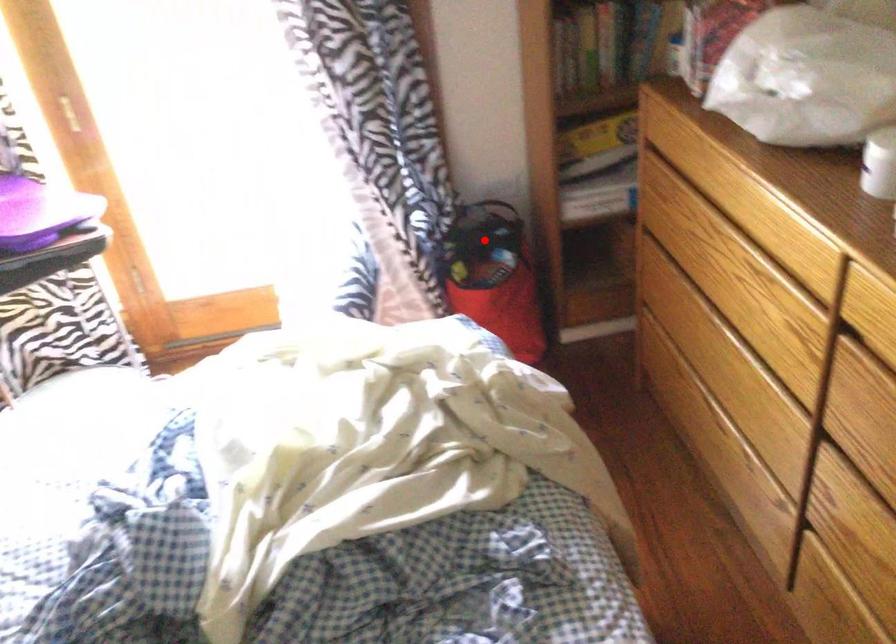
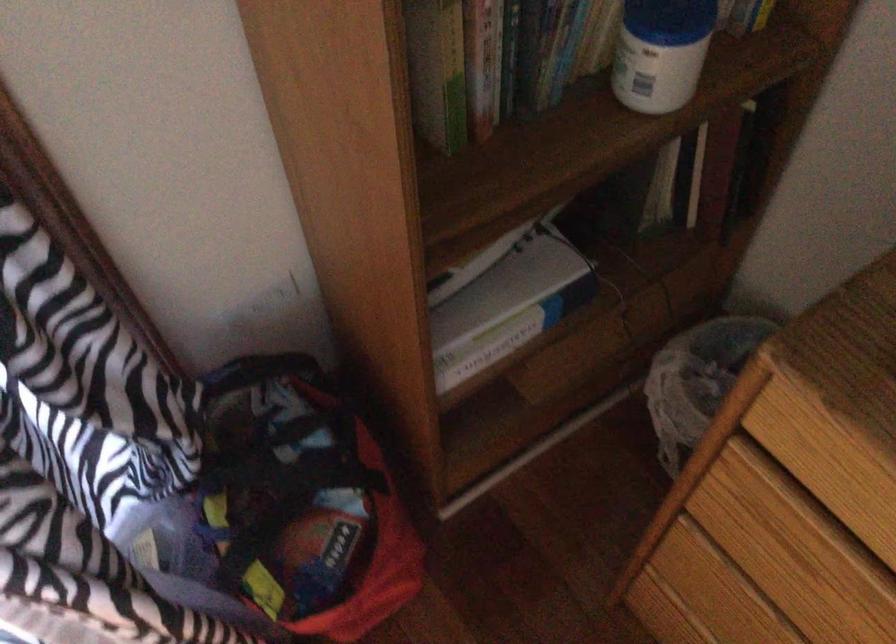
Question: I am providing you with two images of the same scene from different viewpoints. In image1, a red point is highlighted. Considering the same 3D point in image2, which of the following is correct?

Choices:
 (A) It is closer
 (B) It is farther

Answer: (A)